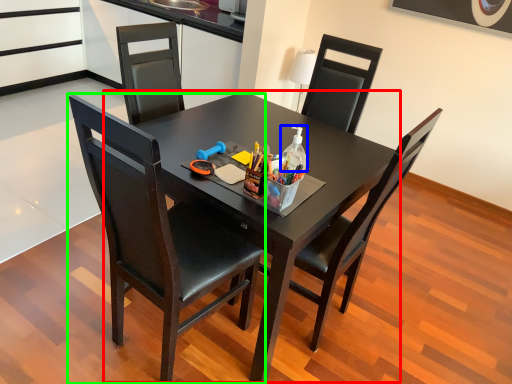
Question: Estimate the real-world distances between objects in this image. Which object is farther from round table (highlighted by a red box), bottle (highlighted by a blue box) or chair (highlighted by a green box)?

Choices:
 (A) bottle
 (B) chair

Answer: (A)